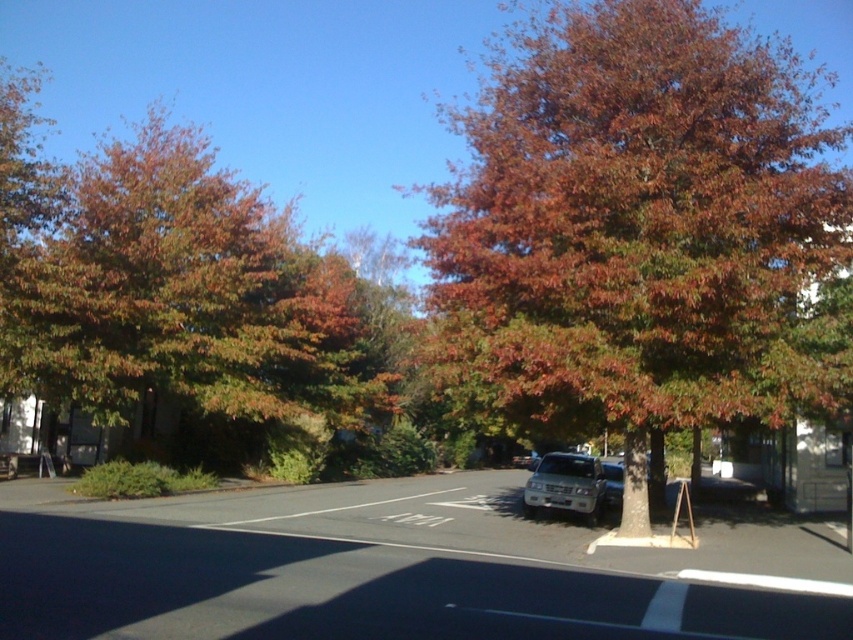
Question: Is reddish-brown bark tree at center further to the viewer compared to satin silver sedan at center?

Choices:
 (A) no
 (B) yes

Answer: (A)

Question: Which object is closer to the camera taking this photo?

Choices:
 (A) reddish-brown bark tree at center
 (B) orange-brown foliage at left
 (C) silver metallic suv at center
 (D) satin silver sedan at center

Answer: (A)

Question: Does reddish-brown bark tree at center have a lesser width compared to silver metallic suv at center?

Choices:
 (A) no
 (B) yes

Answer: (A)

Question: Based on their relative distances, which object is nearer to the reddish-brown bark tree at center?

Choices:
 (A) silver metallic suv at center
 (B) orange-brown foliage at left
 (C) satin silver sedan at center

Answer: (B)

Question: Which object is positioned farthest from the reddish-brown bark tree at center?

Choices:
 (A) orange-brown foliage at left
 (B) silver metallic suv at center
 (C) satin silver sedan at center

Answer: (B)

Question: Does reddish-brown bark tree at center have a smaller size compared to silver metallic suv at center?

Choices:
 (A) no
 (B) yes

Answer: (A)